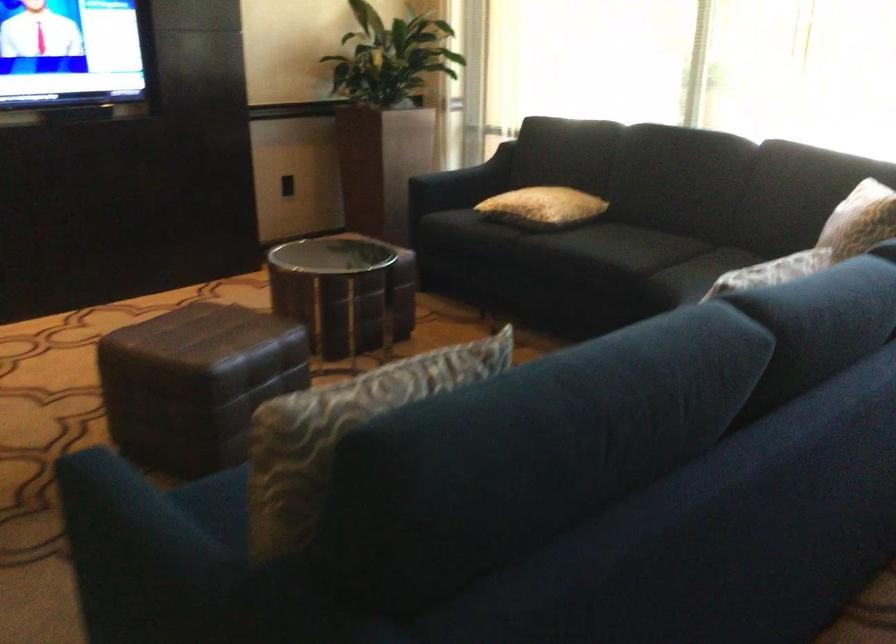
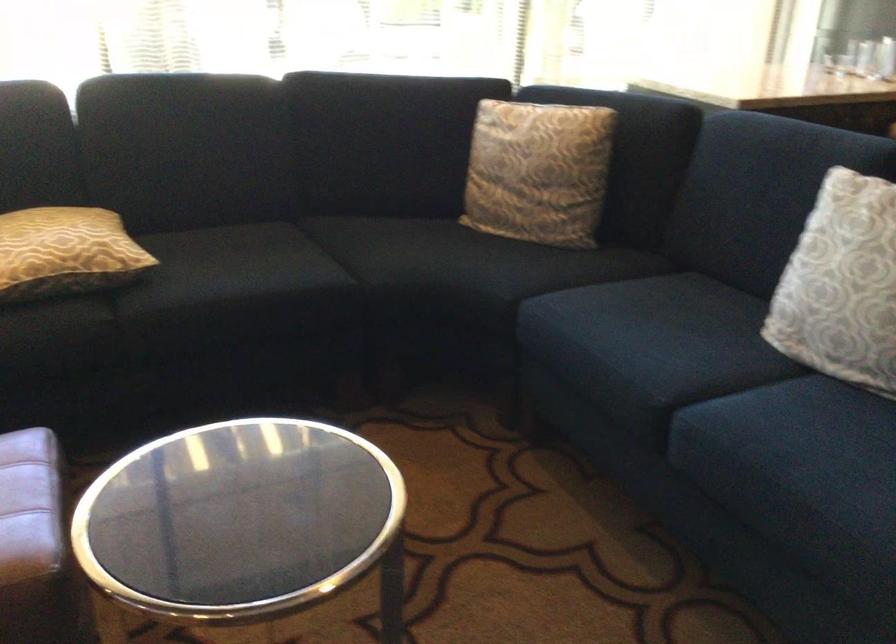
In the second image, find the point that corresponds to point 690,272 in the first image.

(391, 261)